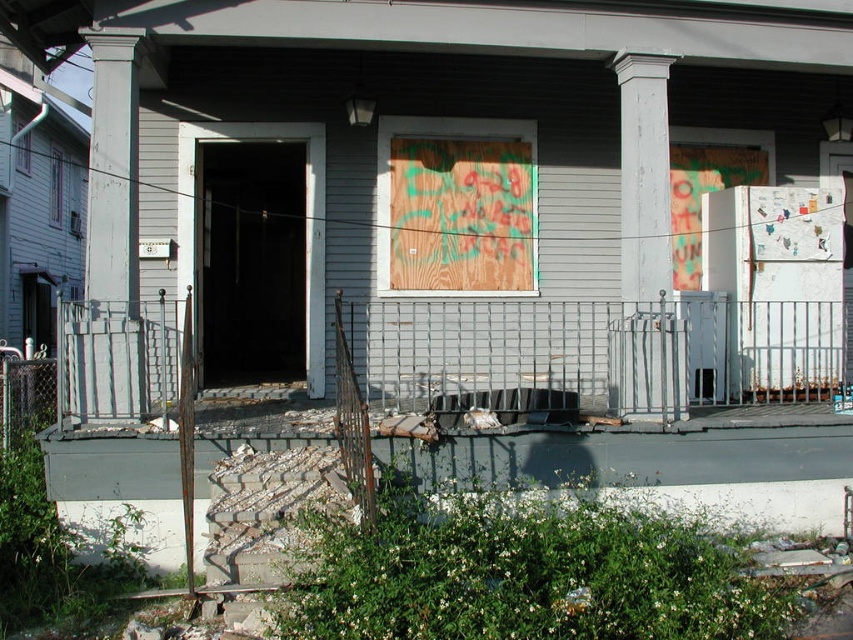
Question: Does smooth gray column at left lie in front of white painted wood column at center?

Choices:
 (A) yes
 (B) no

Answer: (A)

Question: Does smooth gray column at left have a larger size compared to white painted wood column at center?

Choices:
 (A) yes
 (B) no

Answer: (A)

Question: Which point is farther to the camera?

Choices:
 (A) smooth gray column at left
 (B) white painted wood column at center

Answer: (B)

Question: Among these objects, which one is farthest from the camera?

Choices:
 (A) smooth gray column at left
 (B) white painted wood column at center

Answer: (B)

Question: Does smooth gray column at left have a larger size compared to white painted wood column at center?

Choices:
 (A) yes
 (B) no

Answer: (A)